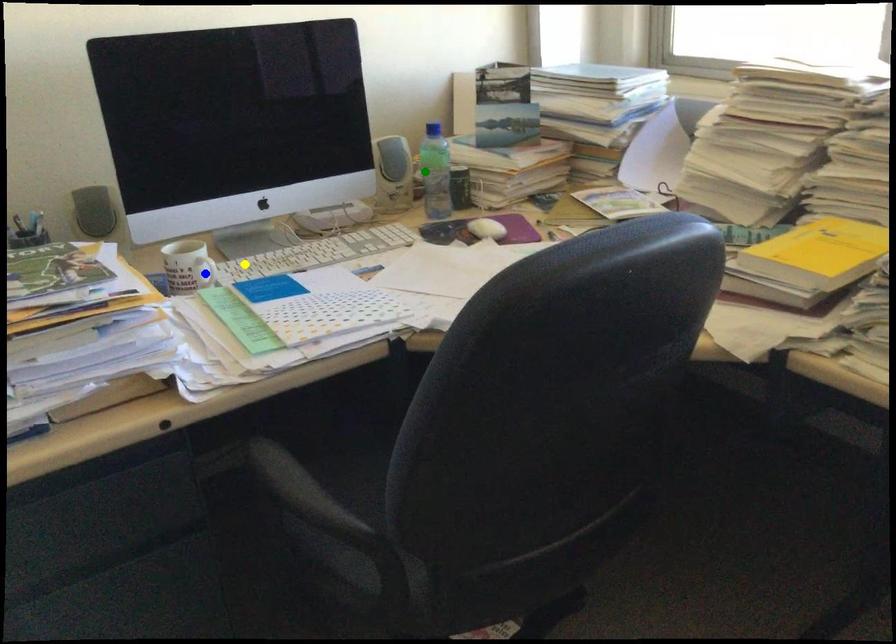
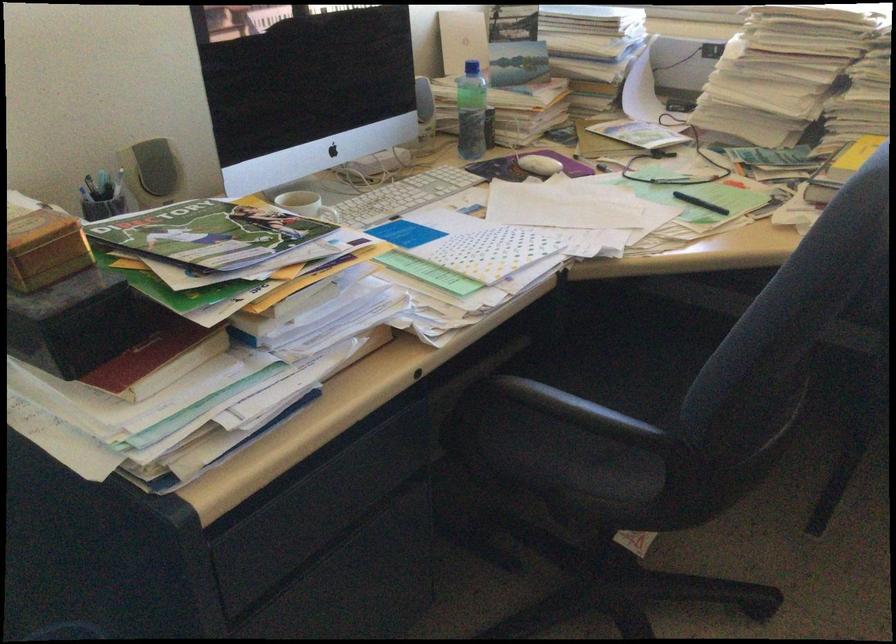
I am providing you with two images of the same scene from different viewpoints. Three points are marked in image1. Which point corresponds to a part or object that is occluded in image2?In image1, three points are marked. Which of them correspond to a part or object that is occluded in image2?Among the three points shown in image1, which one corresponds to a part or object that is no longer visible due to occlusion in image2?

blue point cannot be seen in image2.